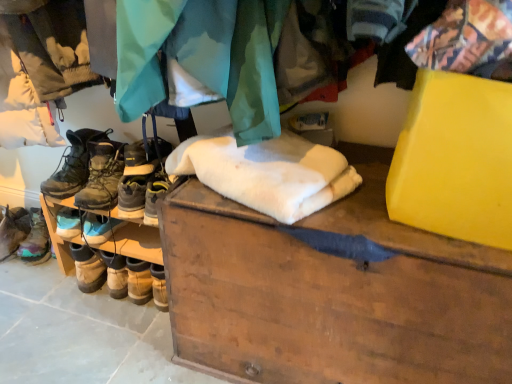
Question: Should I look upward or downward to see leather hiking boots at center, placed as the 1th footwear when sorted from right to left?

Choices:
 (A) down
 (B) up

Answer: (B)

Question: Considering the relative sizes of wooden chest at center and leather boots at left, acting as the 4th footwear starting from the right, in the image provided, is wooden chest at center bigger than leather boots at left, acting as the 4th footwear starting from the right,?

Choices:
 (A) yes
 (B) no

Answer: (A)

Question: From a real-world perspective, is wooden chest at center on top of leather boots at left, acting as the 4th footwear starting from the right?

Choices:
 (A) yes
 (B) no

Answer: (A)

Question: From the image's perspective, is wooden chest at center beneath leather boots at left, acting as the 4th footwear starting from the right?

Choices:
 (A) yes
 (B) no

Answer: (A)

Question: Is the position of wooden chest at center less distant than that of leather boots at left, acting as the 4th footwear starting from the right?

Choices:
 (A) no
 (B) yes

Answer: (B)

Question: Is wooden chest at center at the left side of leather boots at left, acting as the 4th footwear starting from the right?

Choices:
 (A) yes
 (B) no

Answer: (B)

Question: Is wooden chest at center at the right side of leather boots at left, acting as the 4th footwear starting from the right?

Choices:
 (A) yes
 (B) no

Answer: (A)

Question: Is leather boots at left, marked as the 2th footwear in a left-to-right arrangement, aimed at leather hiking boots at left, the 3th footwear positioned from the left?

Choices:
 (A) no
 (B) yes

Answer: (A)

Question: Is leather boots at left, marked as the 2th footwear in a left-to-right arrangement, facing away from leather hiking boots at left, which is counted as the 2th footwear, starting from the right?

Choices:
 (A) yes
 (B) no

Answer: (B)

Question: Does leather boots at left, marked as the 2th footwear in a left-to-right arrangement, have a lesser height compared to leather hiking boots at left, which is counted as the 2th footwear, starting from the right?

Choices:
 (A) no
 (B) yes

Answer: (B)

Question: Is leather boots at left, marked as the 2th footwear in a left-to-right arrangement, to the right of leather hiking boots at left, the 3th footwear positioned from the left, from the viewer's perspective?

Choices:
 (A) yes
 (B) no

Answer: (B)

Question: From the image's perspective, would you say leather boots at left, marked as the 2th footwear in a left-to-right arrangement, is positioned over leather hiking boots at left, which is counted as the 2th footwear, starting from the right?

Choices:
 (A) no
 (B) yes

Answer: (B)

Question: Is leather hiking boots at left, the 3th footwear positioned from the left, inside leather boots at left, marked as the 2th footwear in a left-to-right arrangement?

Choices:
 (A) yes
 (B) no

Answer: (B)

Question: Is leather hiking boots at left, the 3th footwear positioned from the left, to the right of wooden chest at center from the viewer's perspective?

Choices:
 (A) yes
 (B) no

Answer: (B)